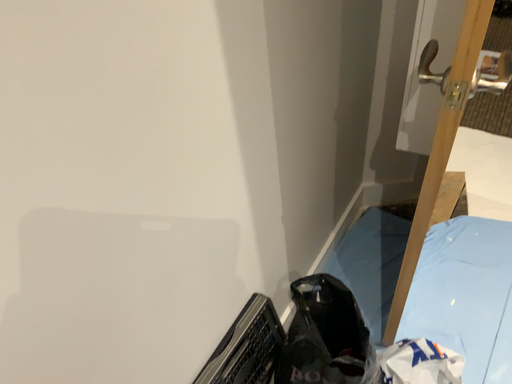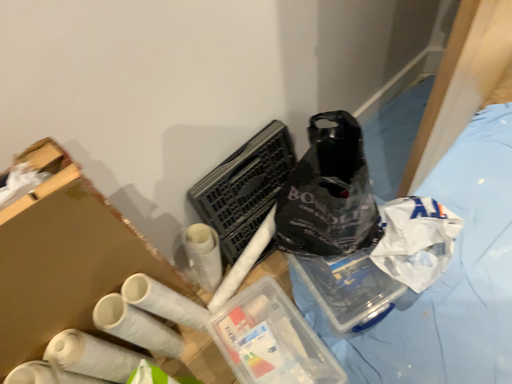
Question: Which way did the camera rotate in the video?

Choices:
 (A) rotated left
 (B) rotated right

Answer: (A)